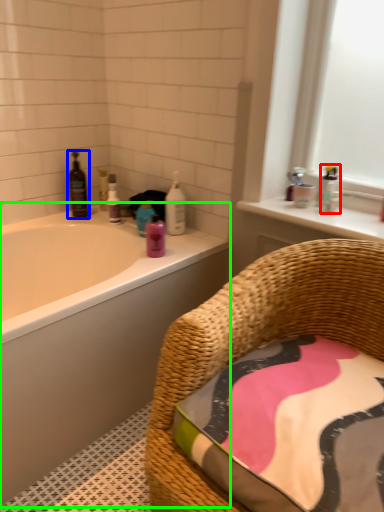
Question: Based on their relative distances, which object is farther from toiletry (highlighted by a red box)? Choose from wine bottle (highlighted by a blue box) and bathtub (highlighted by a green box).

Choices:
 (A) wine bottle
 (B) bathtub

Answer: (A)